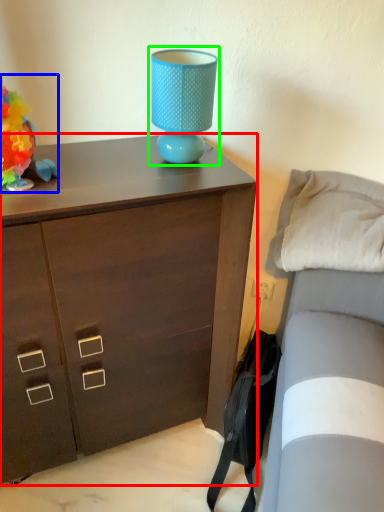
Question: Based on their relative distances, which object is farther from chest of drawers (highlighted by a red box)? Choose from toy (highlighted by a blue box) and table lamp (highlighted by a green box).

Choices:
 (A) toy
 (B) table lamp

Answer: (A)